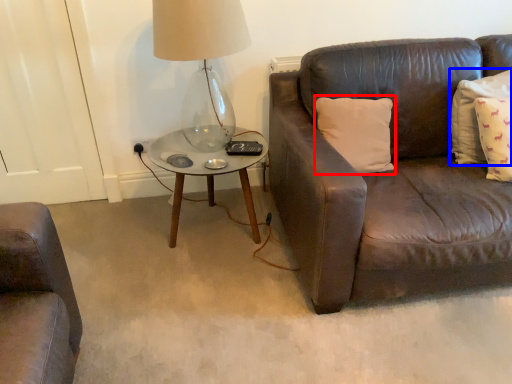
Question: Which object is further to the camera taking this photo, pillow (highlighted by a red box) or pillow (highlighted by a blue box)?

Choices:
 (A) pillow
 (B) pillow

Answer: (A)